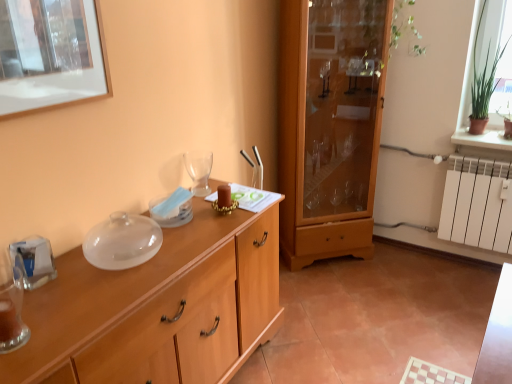
Question: Is the depth of wooden cabinet at center greater than that of transparent glass wine glass at center?

Choices:
 (A) yes
 (B) no

Answer: (A)

Question: From a real-world perspective, does wooden cabinet at center sit lower than transparent glass wine glass at center?

Choices:
 (A) yes
 (B) no

Answer: (A)

Question: Does wooden cabinet at center have a lesser width compared to transparent glass wine glass at center?

Choices:
 (A) no
 (B) yes

Answer: (A)

Question: From the image's perspective, is wooden cabinet at center on transparent glass wine glass at center?

Choices:
 (A) no
 (B) yes

Answer: (B)

Question: From a real-world perspective, does wooden cabinet at center stand above transparent glass wine glass at center?

Choices:
 (A) no
 (B) yes

Answer: (A)

Question: In the image, is translucent glass vase at left positioned in front of or behind wooden cabinet at center?

Choices:
 (A) front
 (B) behind

Answer: (A)

Question: Considering the positions of point (4, 342) and point (306, 238), is point (4, 342) closer or farther from the camera than point (306, 238)?

Choices:
 (A) closer
 (B) farther

Answer: (A)

Question: Is translucent glass vase at left inside the boundaries of wooden cabinet at center, or outside?

Choices:
 (A) inside
 (B) outside

Answer: (B)

Question: From a real-world perspective, is translucent glass vase at left physically located above or below wooden cabinet at center?

Choices:
 (A) above
 (B) below

Answer: (A)

Question: Relative to translucent glass vase at left, is wooden cabinet at center in front or behind?

Choices:
 (A) behind
 (B) front

Answer: (A)

Question: Choose the correct answer: Is wooden cabinet at center inside translucent glass vase at left or outside it?

Choices:
 (A) inside
 (B) outside

Answer: (B)

Question: Considering the positions of wooden cabinet at center and translucent glass vase at left in the image, is wooden cabinet at center bigger or smaller than translucent glass vase at left?

Choices:
 (A) small
 (B) big

Answer: (B)

Question: From the image's perspective, is wooden cabinet at center positioned above or below translucent glass vase at left?

Choices:
 (A) below
 (B) above

Answer: (B)

Question: In terms of height, does translucent glass vase at left look taller or shorter compared to transparent glass wine glass at center?

Choices:
 (A) short
 (B) tall

Answer: (A)

Question: From a real-world perspective, is translucent glass vase at left above or below transparent glass wine glass at center?

Choices:
 (A) below
 (B) above

Answer: (A)